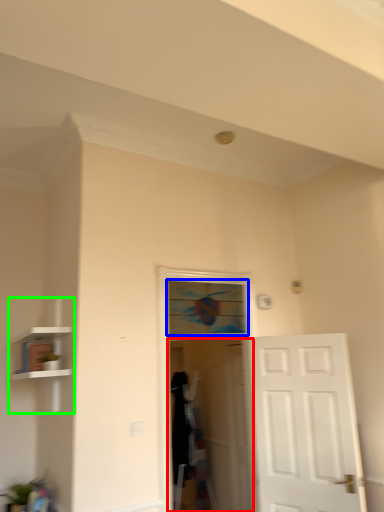
Question: Which object is the closest to the screen door (highlighted by a red box)? Choose among these: window (highlighted by a blue box) or bookshelf (highlighted by a green box).

Choices:
 (A) window
 (B) bookshelf

Answer: (A)